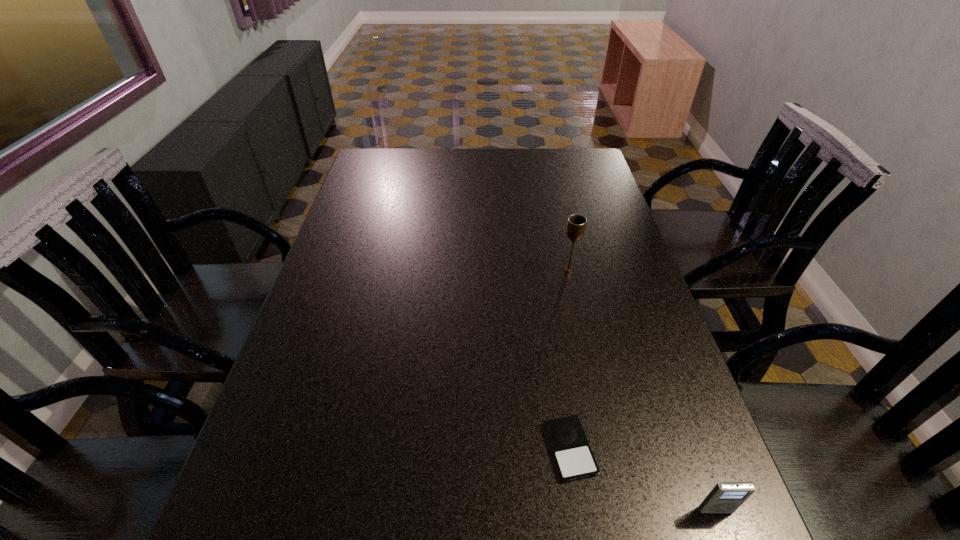
Where is `the farthest object`? This screenshot has width=960, height=540. the farthest object is located at coordinates (576, 224).

Where is `the second object from right to left`? the second object from right to left is located at coordinates (576, 224).

The height and width of the screenshot is (540, 960). I want to click on the second tallest object, so click(726, 497).

Identify the location of the rightmost object. (726, 497).

Image resolution: width=960 pixels, height=540 pixels. Find the location of `the leftmost object`. the leftmost object is located at coordinates (572, 454).

Identify the location of the left iPod. This screenshot has width=960, height=540. (572, 454).

The width and height of the screenshot is (960, 540). In order to click on free spot located 0.250m on the front of the chalice in this screenshot , I will do `click(586, 348)`.

Locate an element on the screen. The width and height of the screenshot is (960, 540). free region located on the left of the second nearest object is located at coordinates (417, 449).

The height and width of the screenshot is (540, 960). I want to click on object that is at the right edge, so click(x=726, y=497).

In order to click on free location at the far edge of the desktop in this screenshot , I will do `click(486, 167)`.